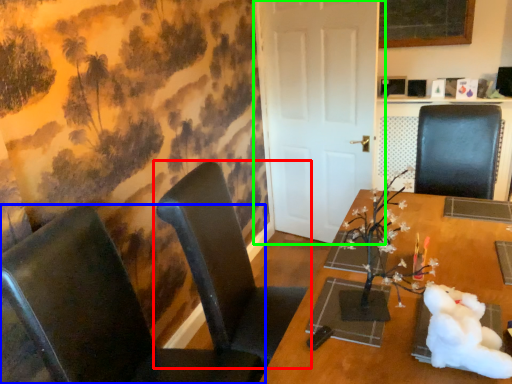
Question: Estimate the real-world distances between objects in this image. Which object is farther from chair (highlighted by a red box), chair (highlighted by a blue box) or door (highlighted by a green box)?

Choices:
 (A) chair
 (B) door

Answer: (B)